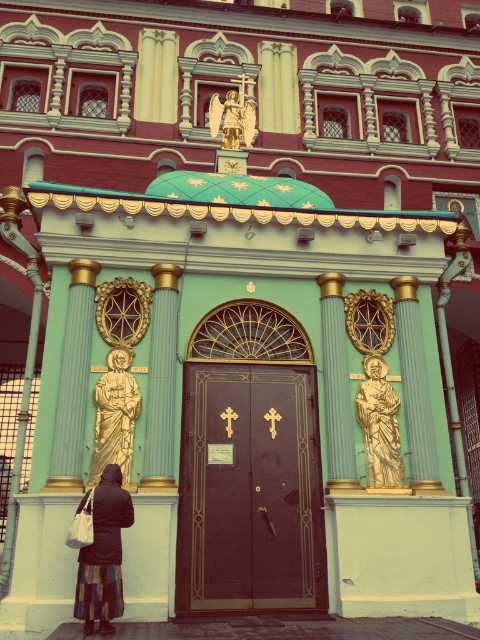
Which is above, dark brown wooden door at center or dark brown leather coat at lower center?

Positioned higher is dark brown wooden door at center.

You are a GUI agent. You are given a task and a screenshot of the screen. Output one action in this format:
    pyautogui.click(x=<x>, y=<y>)
    Task: Click on the dark brown wooden door at center
    The width and height of the screenshot is (480, 640).
    Given the screenshot: What is the action you would take?
    pyautogui.click(x=252, y=488)

Find the location of `dark brown wooden door at center`. dark brown wooden door at center is located at coordinates (252, 488).

Where is `dark brown wooden door at center`? The width and height of the screenshot is (480, 640). dark brown wooden door at center is located at coordinates coord(252,488).

Which is in front, point (206, 540) or point (365, 449)?

Point (206, 540)

Can you confirm if dark brown wooden door at center is thinner than gold polished statue at right?

Incorrect, dark brown wooden door at center's width is not less than gold polished statue at right's.

Does point (260, 410) come behind point (393, 419)?

No, it is not.

Identify the location of dark brown wooden door at center. (252, 488).

Which is more to the left, gold polished statue at right or gold/gilded statue at center?

gold/gilded statue at center is more to the left.

Can you confirm if gold polished statue at right is bigger than gold/gilded statue at center?

No.

Does point (373, 422) come in front of point (228, 132)?

Yes, it is.

In order to click on gold polished statue at right in this screenshot , I will do [380, 426].